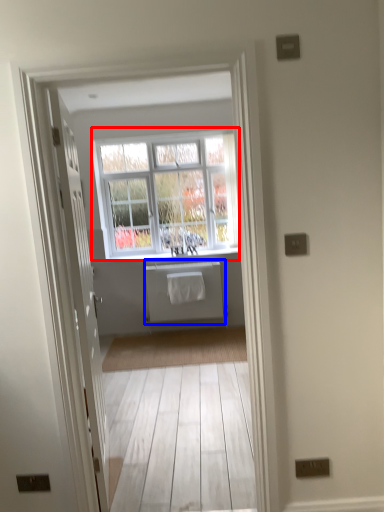
Question: Which point is closer to the camera, window (highlighted by a red box) or appliance (highlighted by a blue box)?

Choices:
 (A) window
 (B) appliance

Answer: (A)